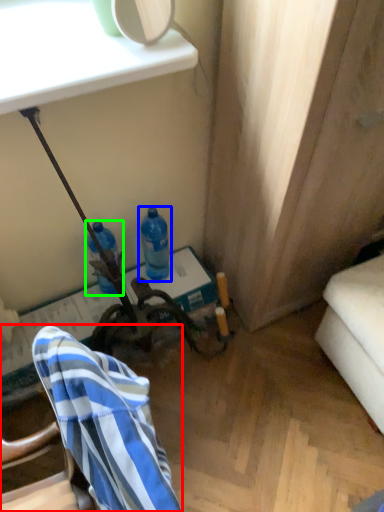
Question: Which object is positioned closest to chair (highlighted by a red box)? Select from bottle (highlighted by a blue box) and bottle (highlighted by a green box).

Choices:
 (A) bottle
 (B) bottle

Answer: (B)